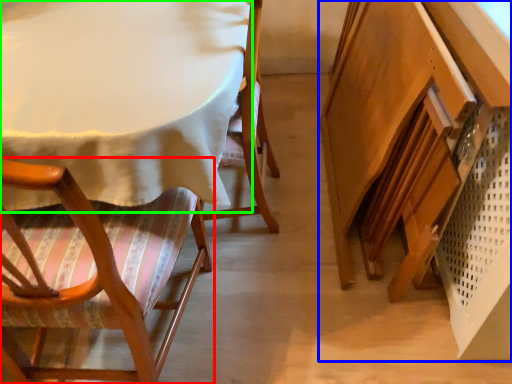
Question: Estimate the real-world distances between objects in this image. Which object is farther from chair (highlighted by a red box), vanity (highlighted by a blue box) or table (highlighted by a green box)?

Choices:
 (A) vanity
 (B) table

Answer: (A)